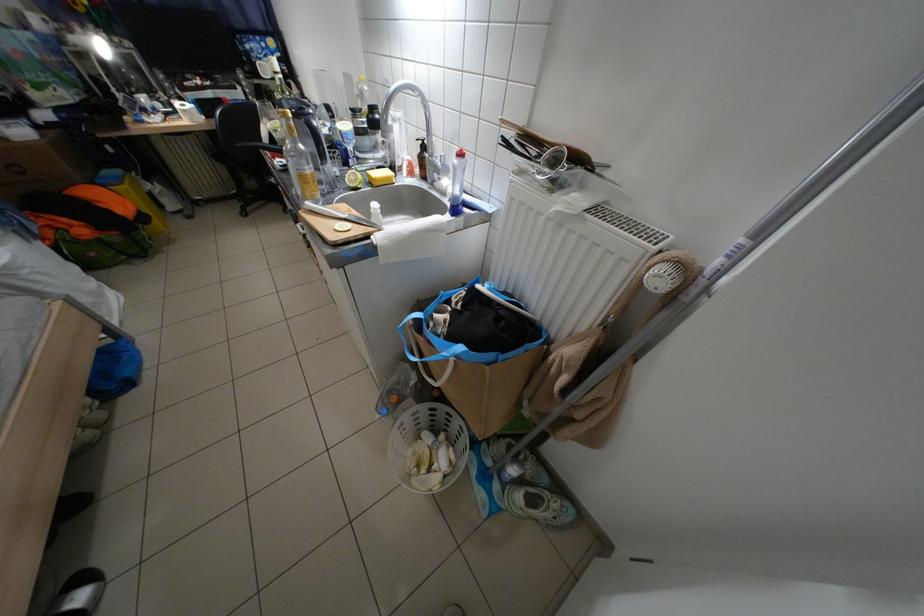
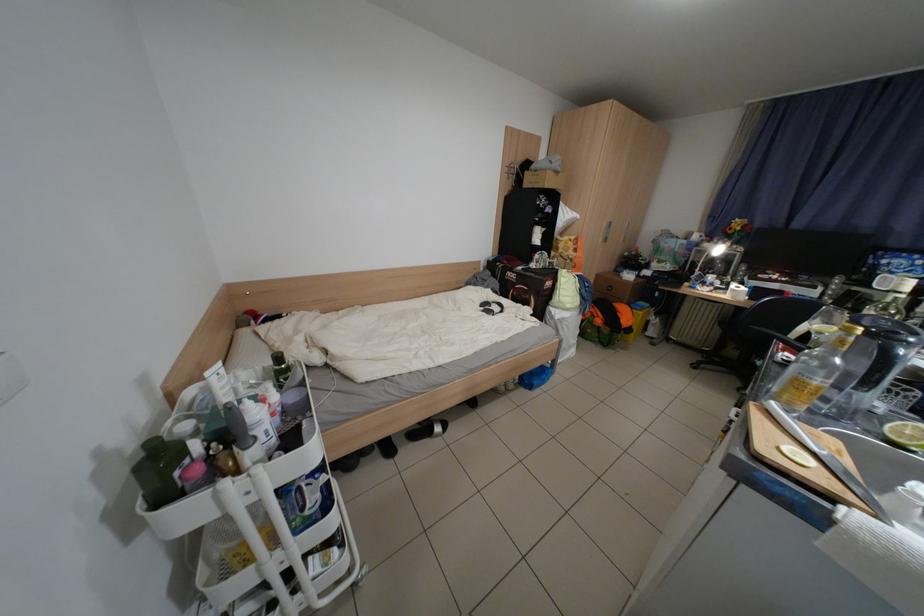
The point at (382, 231) is marked in the first image. Where is the corresponding point in the second image?

(864, 500)